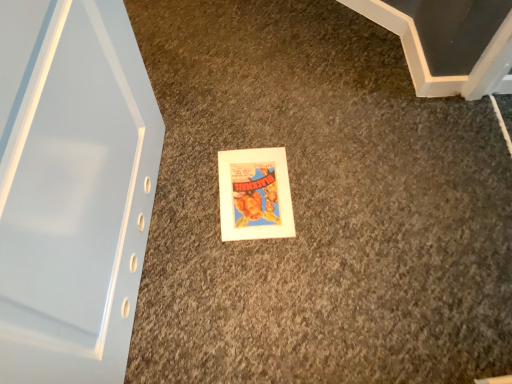
Locate an element on the screen. vacant region to the right of white glossy door at left is located at coordinates (278, 236).